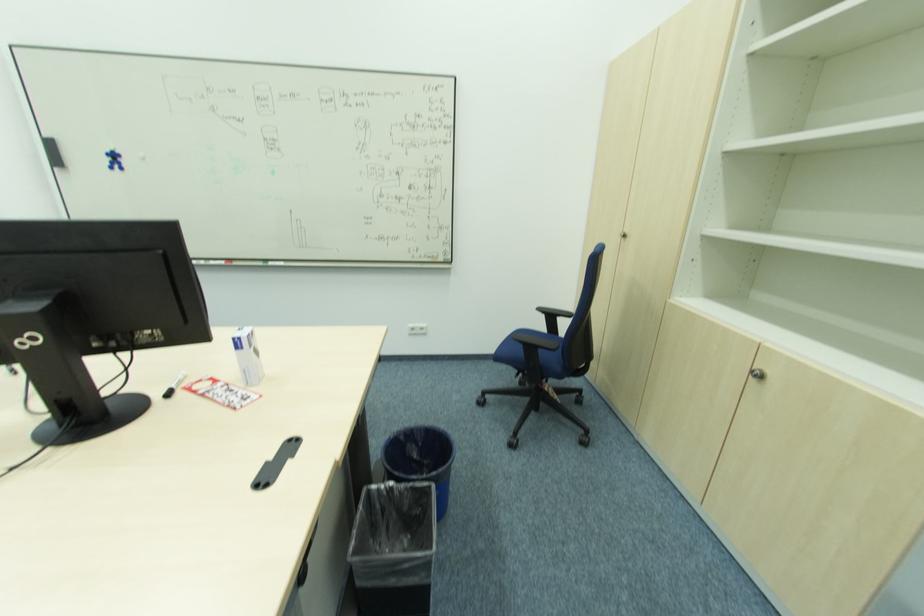
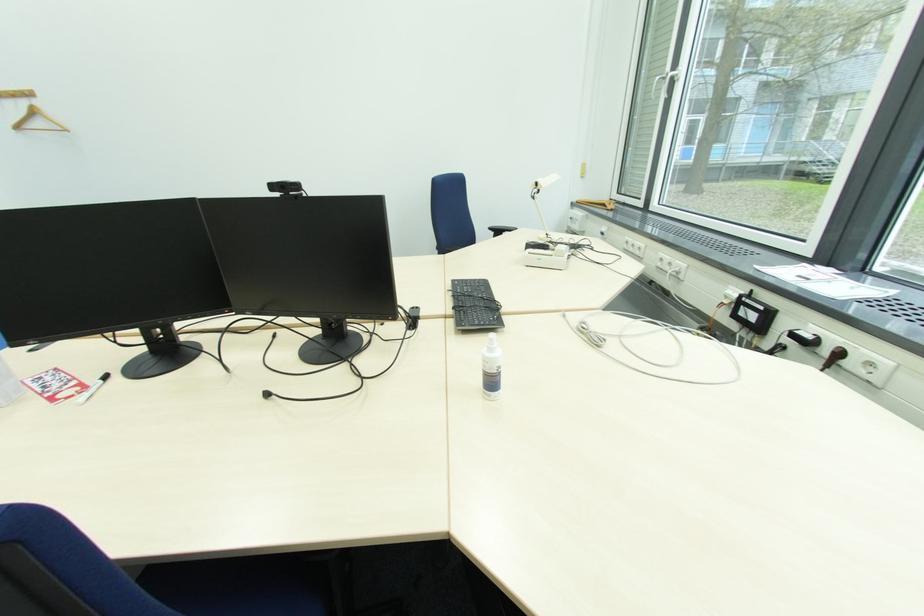
Locate, in the second image, the point that corresponds to the point at 185,394 in the first image.

(100, 384)